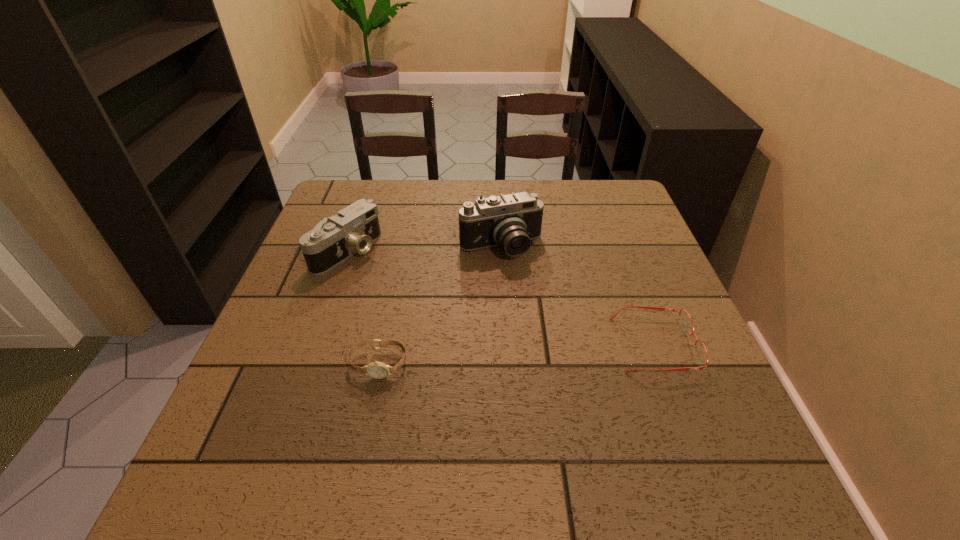
Where is `vacant space on the desktop that is between the second object from left to right and the rightmost object and is positioned on the lens of the leftmost object`? vacant space on the desktop that is between the second object from left to right and the rightmost object and is positioned on the lens of the leftmost object is located at coordinates (529, 353).

At what (x,y) coordinates should I click in order to perform the action: click on free space on the desktop that is between the third object from right to left and the rightmost object and is positioned on the front-facing side of the third object from left to right. Please return your answer as a coordinate pair (x, y). Looking at the image, I should click on (558, 352).